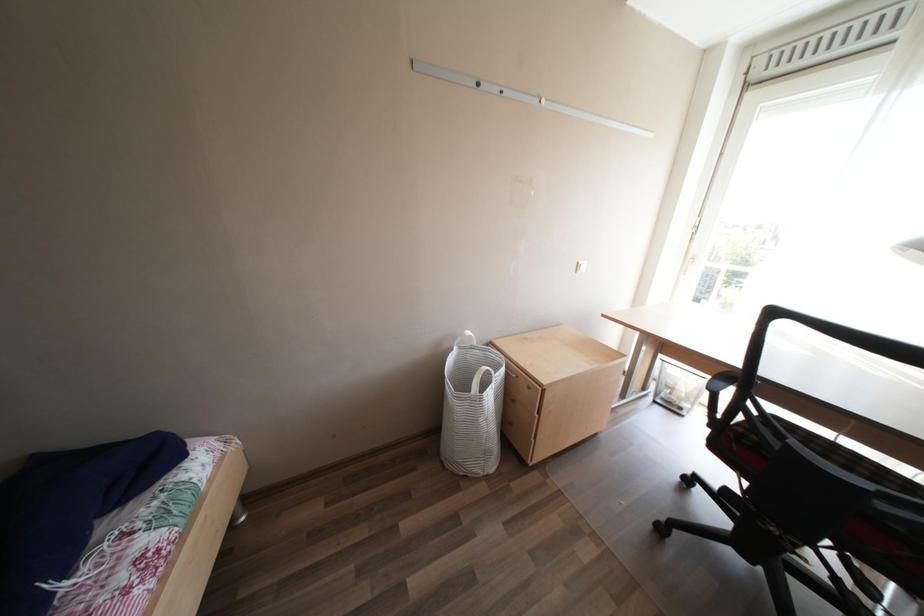
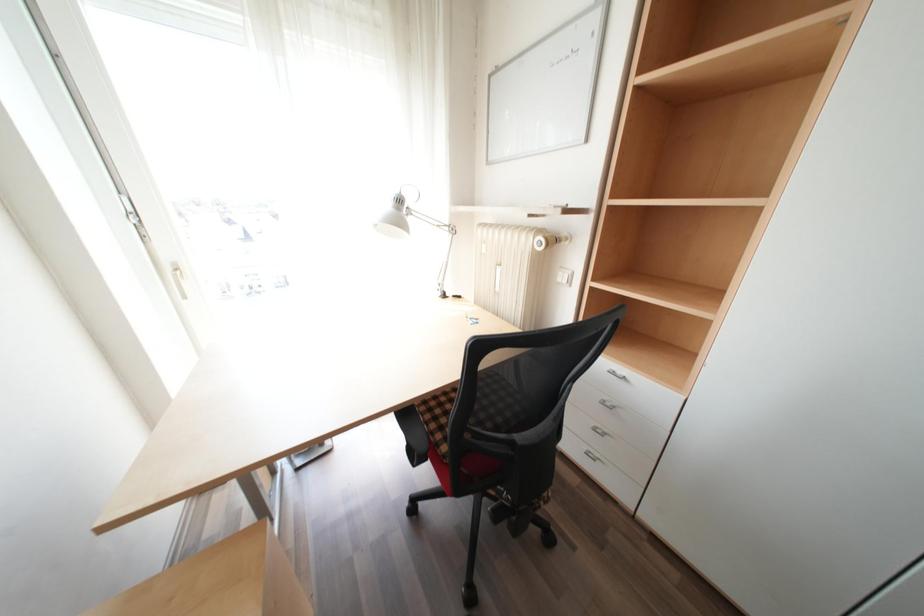
How did the camera likely rotate?

The camera's rotation is toward right-down.